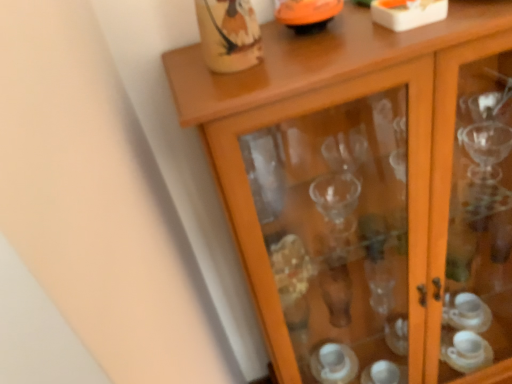
The width and height of the screenshot is (512, 384). What are the coordinates of `vacant space situated on the left part of orange glossy bowl at upper center` in the screenshot? It's located at (237, 62).